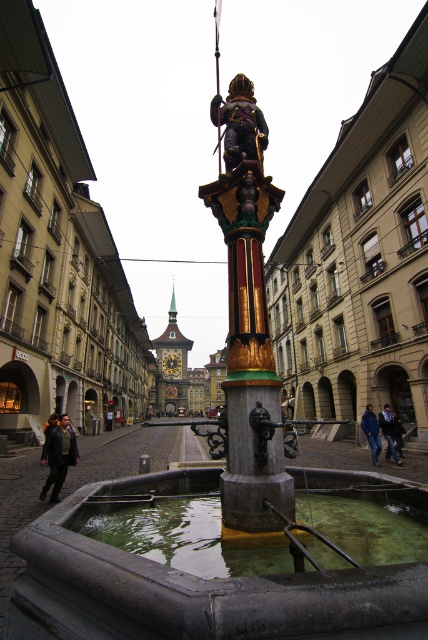
Between gold polished statue at center and dark blue jacket at lower right, which one is positioned lower?

Positioned lower is dark blue jacket at lower right.

In the scene shown: Is the position of gold polished statue at center more distant than that of dark blue jacket at lower right?

That is False.

Is point (228, 104) closer to viewer compared to point (386, 422)?

Yes, it is in front of point (386, 422).

What are the coordinates of `gold polished statue at center` in the screenshot? It's located at (240, 122).

Is dark blue jacket at lower right thinner than dark blue jeans at lower right?

Yes, dark blue jacket at lower right is thinner than dark blue jeans at lower right.

Does dark blue jacket at lower right have a larger size compared to dark blue jeans at lower right?

Actually, dark blue jacket at lower right might be smaller than dark blue jeans at lower right.

Find the location of `dark blue jacket at lower right`. dark blue jacket at lower right is located at coordinates (389, 432).

Who is shorter, gold clock tower at center or dark blue jacket at lower right?

dark blue jacket at lower right

Is point (172, 362) positioned behind point (383, 428)?

Yes, it is behind point (383, 428).

Where is `gold clock tower at center`? This screenshot has height=640, width=428. gold clock tower at center is located at coordinates (172, 364).